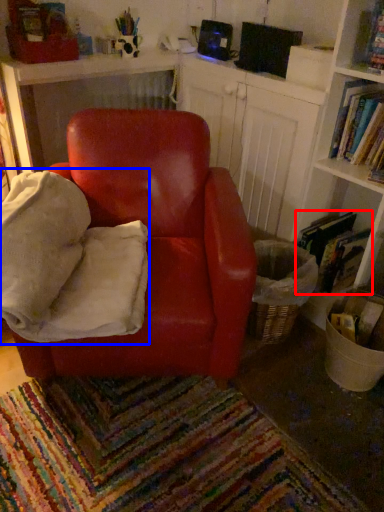
Question: Which point is further to the camera, book (highlighted by a red box) or bean bag chair (highlighted by a blue box)?

Choices:
 (A) book
 (B) bean bag chair

Answer: (A)